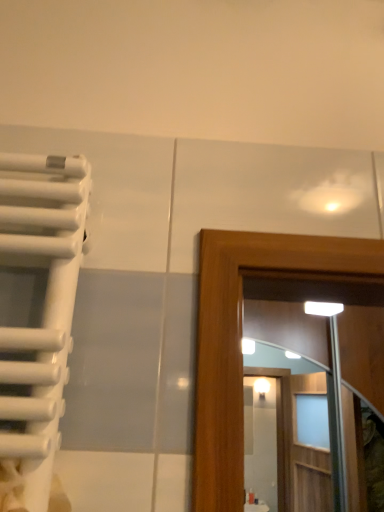
This screenshot has height=512, width=384. What do you see at coordinates (241, 331) in the screenshot?
I see `transparent glass screen door at upper right` at bounding box center [241, 331].

Find the location of a particular element. transparent glass screen door at upper right is located at coordinates (241, 331).

Find the location of a particular element. This screenshot has height=512, width=384. transparent glass screen door at upper right is located at coordinates (241, 331).